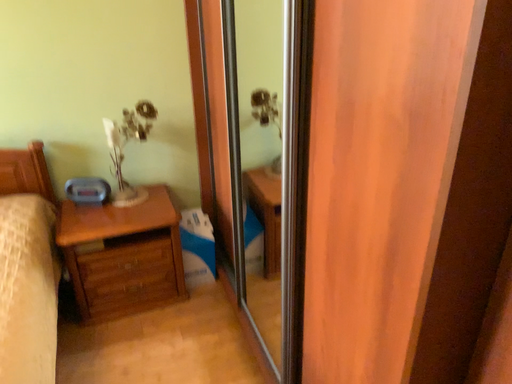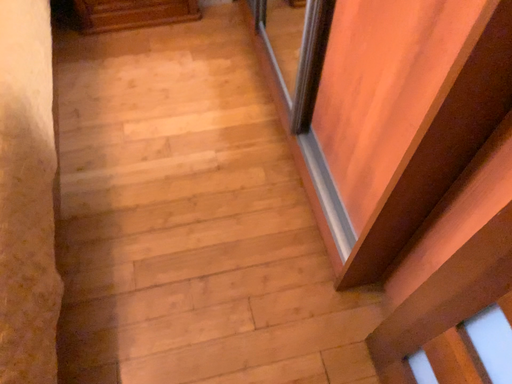
Question: How did the camera likely rotate when shooting the video?

Choices:
 (A) rotated downward
 (B) rotated upward

Answer: (A)